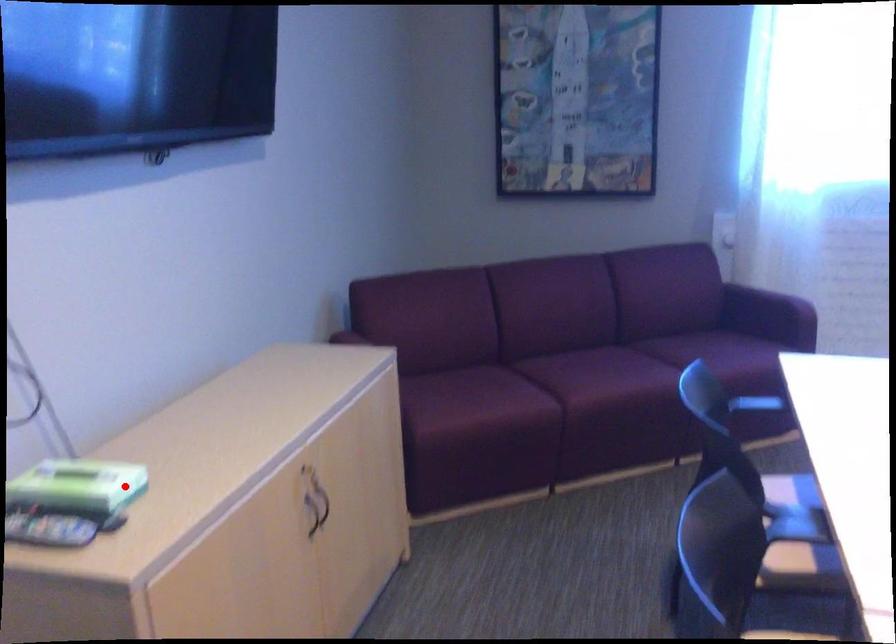
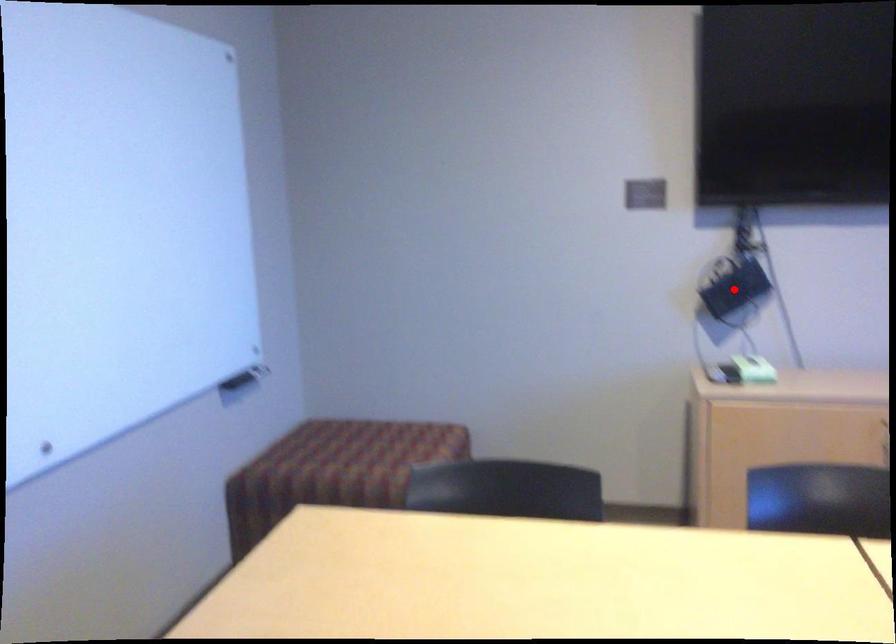
I am providing you with two images of the same scene from different viewpoints. A red point is marked on the first image and another point is marked on the second image. Is the red point in image1 aligned with the point shown in image2?

No